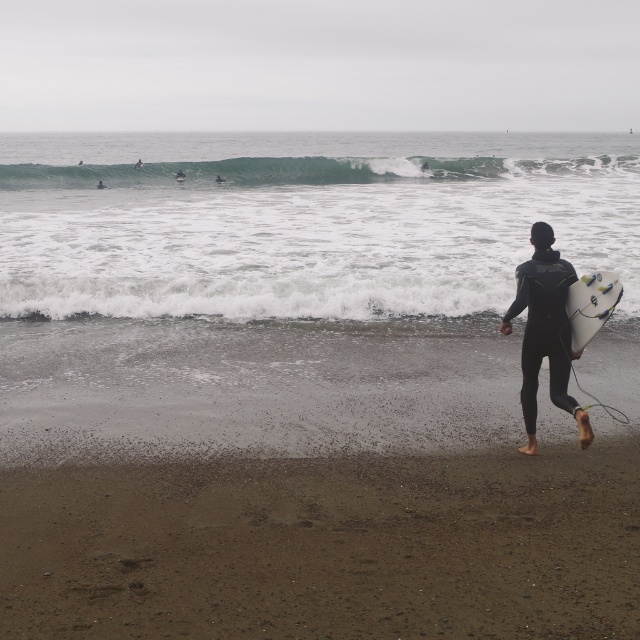
Who is shorter, dark sand at lower center or white glossy surfboard at right?

With less height is white glossy surfboard at right.

Does dark sand at lower center have a lesser height compared to white glossy surfboard at right?

No.

Is point (145, 321) farther from viewer compared to point (586, 308)?

That is True.

Find the location of `dark sand at lower center`. dark sand at lower center is located at coordinates (308, 483).

Does point (132, 499) lie behind point (541, 248)?

No, it is in front of (541, 248).

The width and height of the screenshot is (640, 640). Describe the element at coordinates (308, 483) in the screenshot. I see `dark sand at lower center` at that location.

Is point (51, 586) behind point (538, 333)?

That is False.

Locate an element on the screen. This screenshot has height=640, width=640. dark sand at lower center is located at coordinates (308, 483).

Who is more distant from viewer, (227, 230) or (525, 390)?

Positioned behind is point (227, 230).

Is white foamy water at center positioned before black matte wetsuit at center?

No, it is behind black matte wetsuit at center.

Which is in front, point (264, 269) or point (547, 314)?

Point (547, 314)

Where is `white foamy water at center`? white foamy water at center is located at coordinates (305, 221).